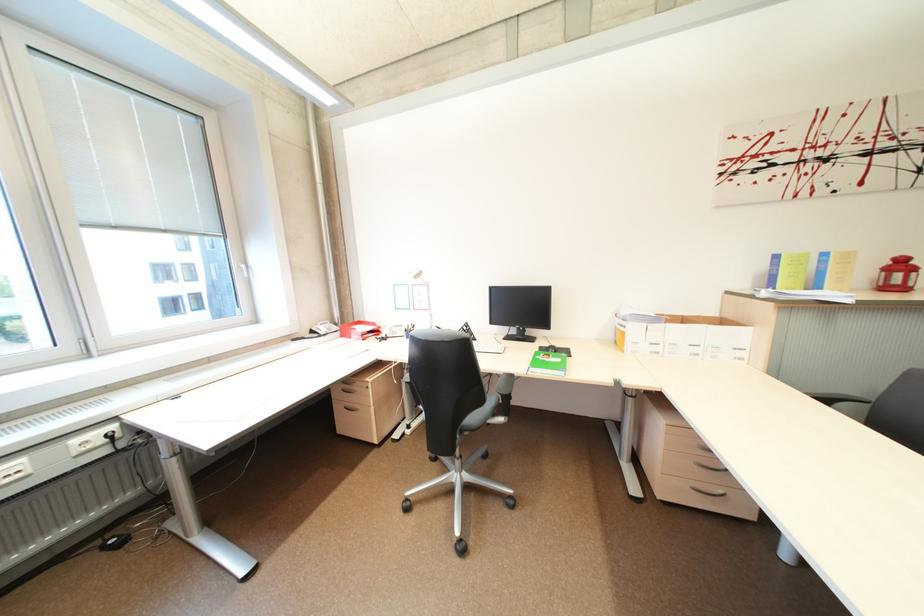
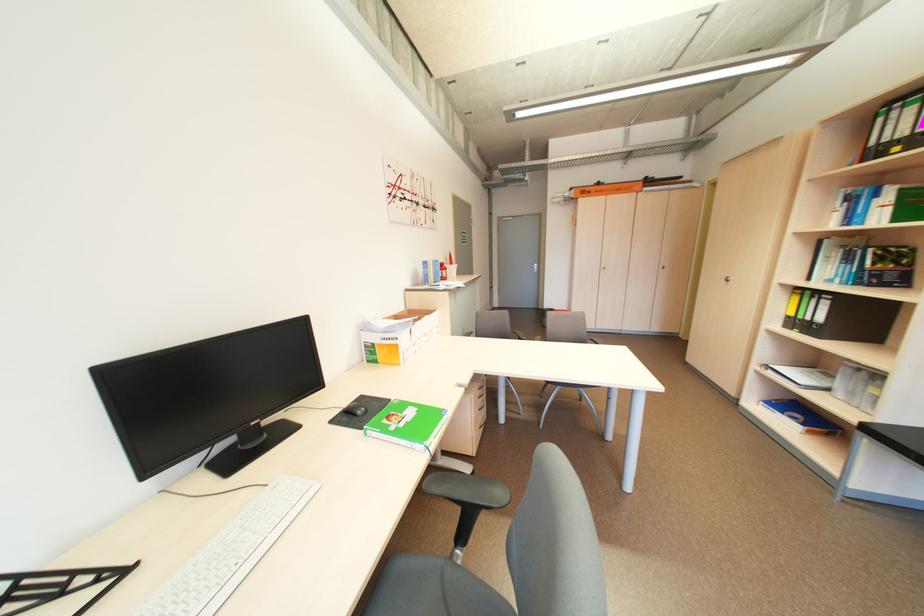
Question: I am providing you with two images of the same scene from different viewpoints. Please identify which objects are invisible in image2.

Choices:
 (A) black computer mouse
 (B) green patterned pillow
 (C) gray chair armrest
 (D) cardboard box

Answer: (C)